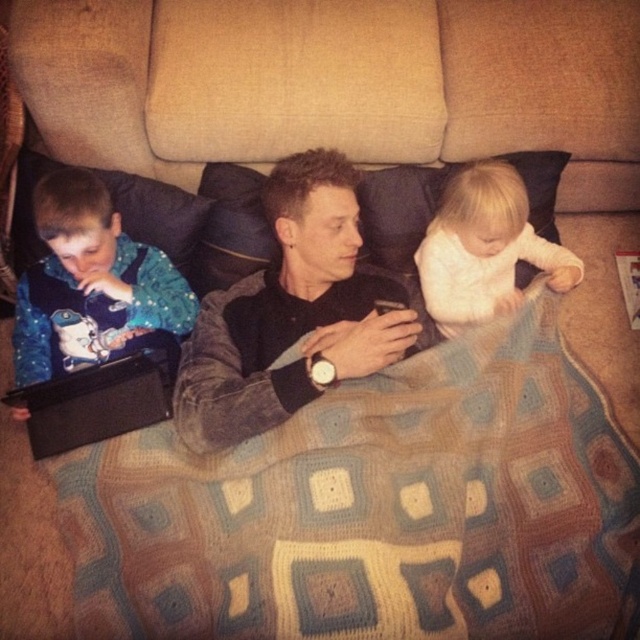
Based on the scene description, where is the blue fabric baby at left located in terms of coordinates?

The blue fabric baby at left is located at coordinates point (90,284).

You are a parent trying to find your baby who is under the blanket on the couch. The blue fabric baby at left and white soft fabric at center are part of the blanket. Which part of the blanket is covering your baby?

The blue fabric baby at left is in front of the white soft fabric at center, so the white soft fabric at center is the part of the blanket covering your baby.